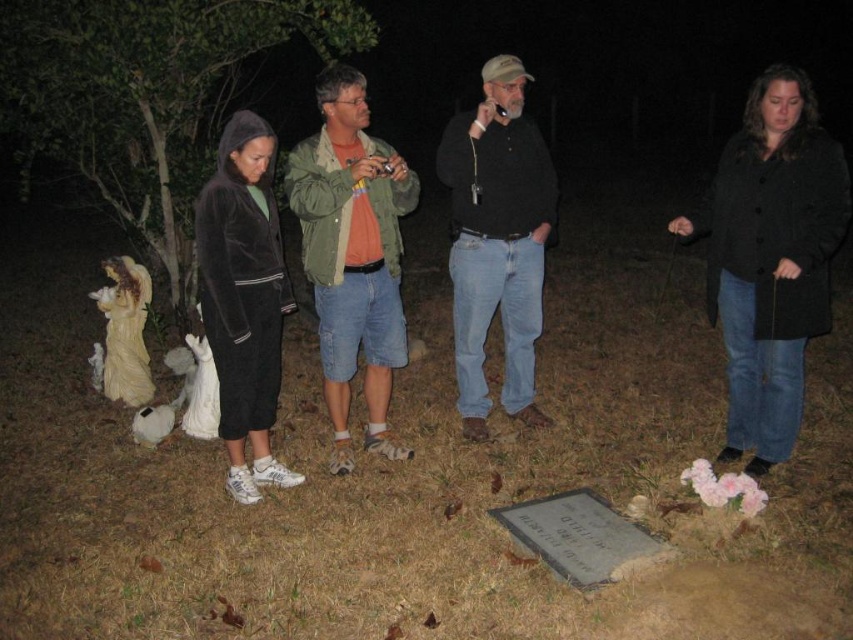
Is point (527, 140) more distant than point (247, 468)?

Yes, it is.

Between black matte shirt at center and velvety black coat at center, which one is positioned higher?

Positioned higher is black matte shirt at center.

Is point (483, 298) more distant than point (236, 348)?

Yes, point (483, 298) is behind point (236, 348).

In order to click on black matte shirt at center in this screenshot , I will do `click(497, 240)`.

How far apart are black wool coat at right and green-cotton jacket at center?

black wool coat at right is 5.88 feet from green-cotton jacket at center.

Between black wool coat at right and green-cotton jacket at center, which one has more height?

green-cotton jacket at center is taller.

Find the location of a particular element. This screenshot has width=853, height=640. black wool coat at right is located at coordinates click(770, 257).

Is black wool coat at right shorter than black matte shirt at center?

Correct, black wool coat at right is not as tall as black matte shirt at center.

In the scene shown: Is black wool coat at right smaller than black matte shirt at center?

Yes.

Does point (833, 244) come behind point (520, 282)?

No, (833, 244) is closer to viewer.

In order to click on black wool coat at right in this screenshot , I will do `click(770, 257)`.